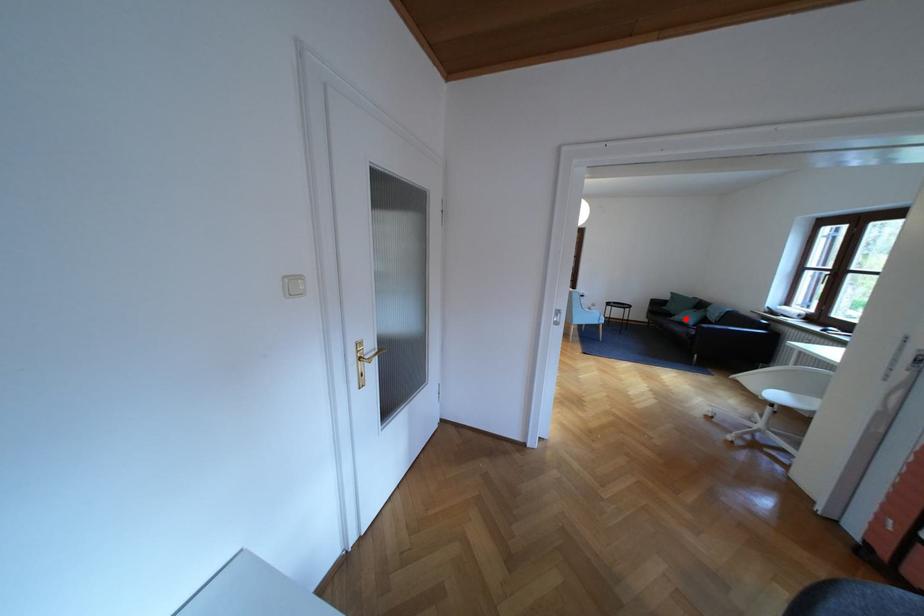
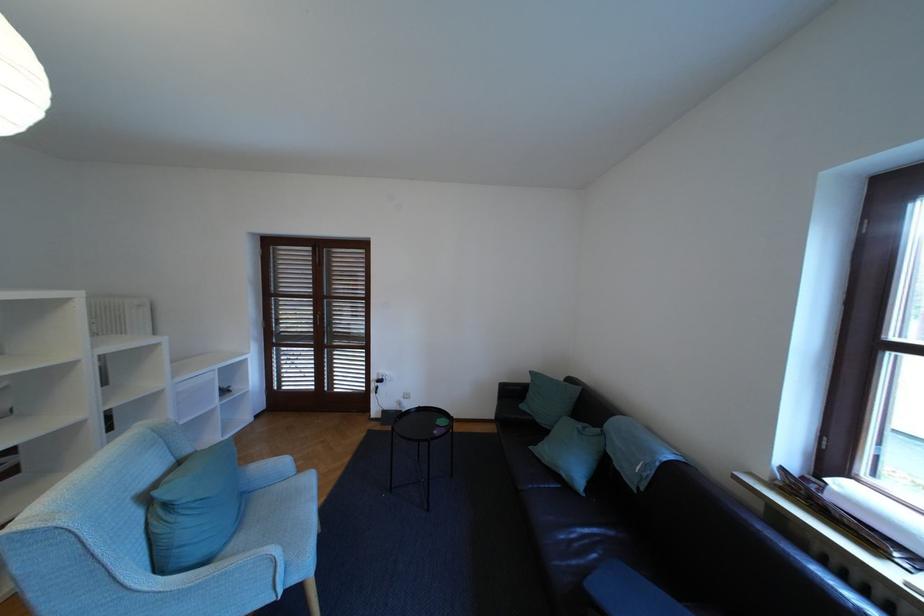
In the second image, find the point that corresponds to the highlighted location in the first image.

(554, 452)